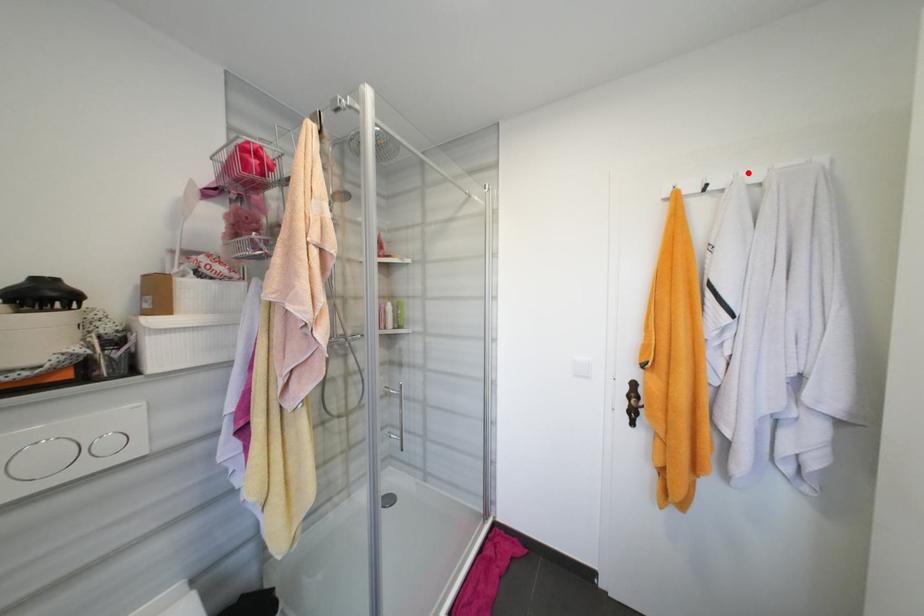
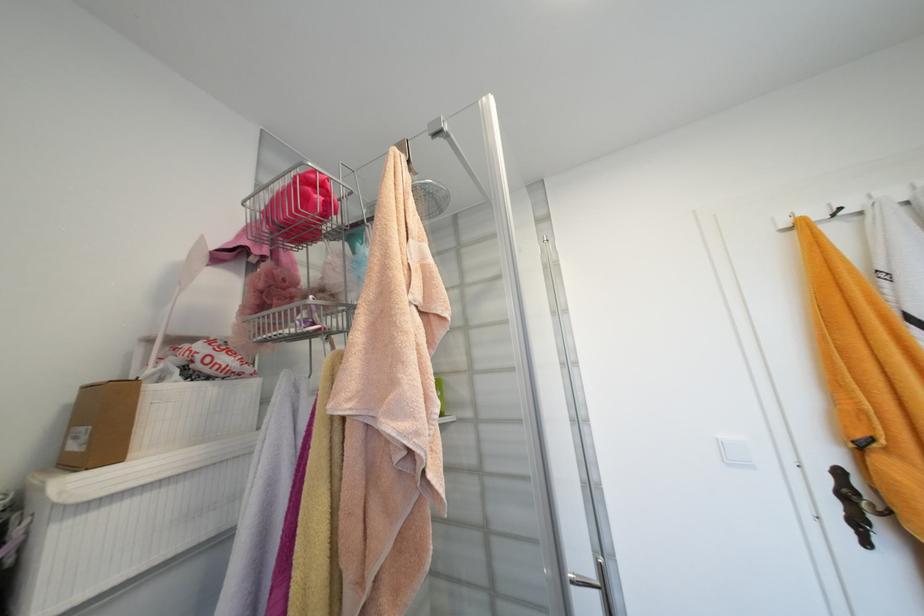
The point at the highlighted location is marked in the first image. Where is the corresponding point in the second image?

(885, 193)